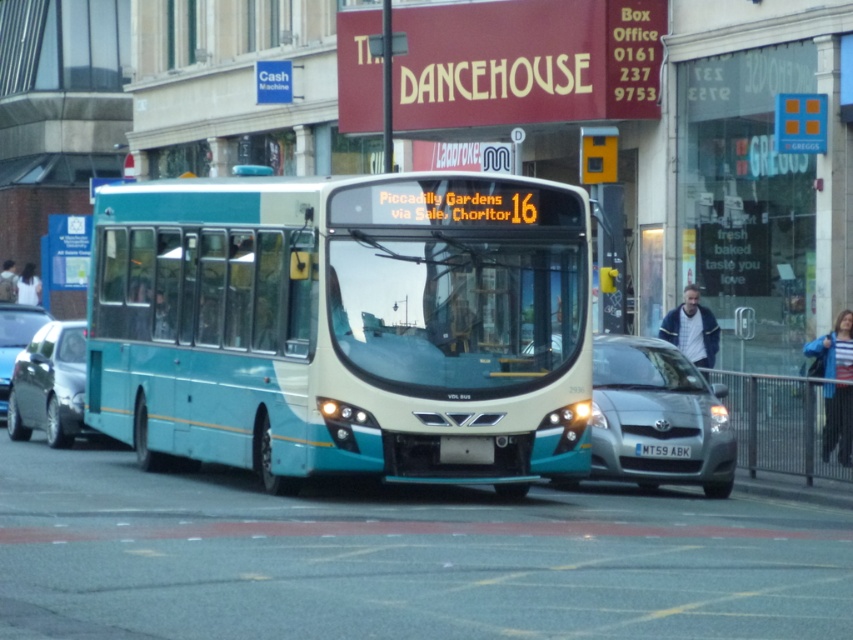
You are a city planner analyzing traffic flow. You need to determine which vehicle takes up more space on the road between the teal matte bus at center and the metallic silver car at center. Which one is larger?

The metallic silver car at center takes up more space than the teal matte bus at center because the teal matte bus at center occupies less space than the metallic silver car at center.

You are a pedestrian standing on the sidewalk and see the teal matte bus at center and the white plastic license plate at center. Which object is bigger?

The teal matte bus at center is larger than the white plastic license plate at center.